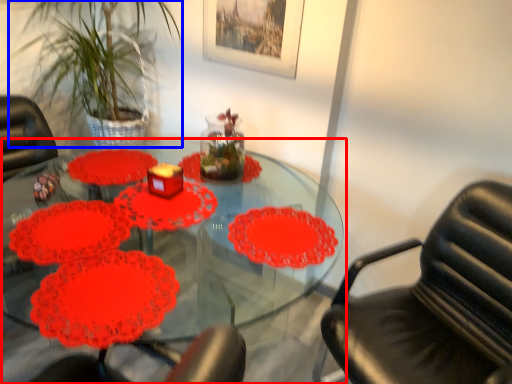
Question: Which object is closer to the camera taking this photo, table (highlighted by a red box) or plant (highlighted by a blue box)?

Choices:
 (A) table
 (B) plant

Answer: (A)